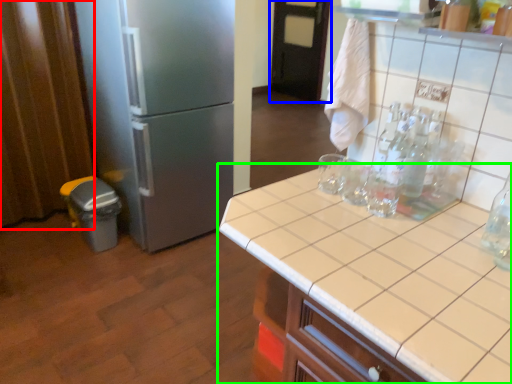
Question: Considering the real-world distances, which object is farthest from curtain (highlighted by a red box)? door (highlighted by a blue box) or countertop (highlighted by a green box)?

Choices:
 (A) door
 (B) countertop

Answer: (A)